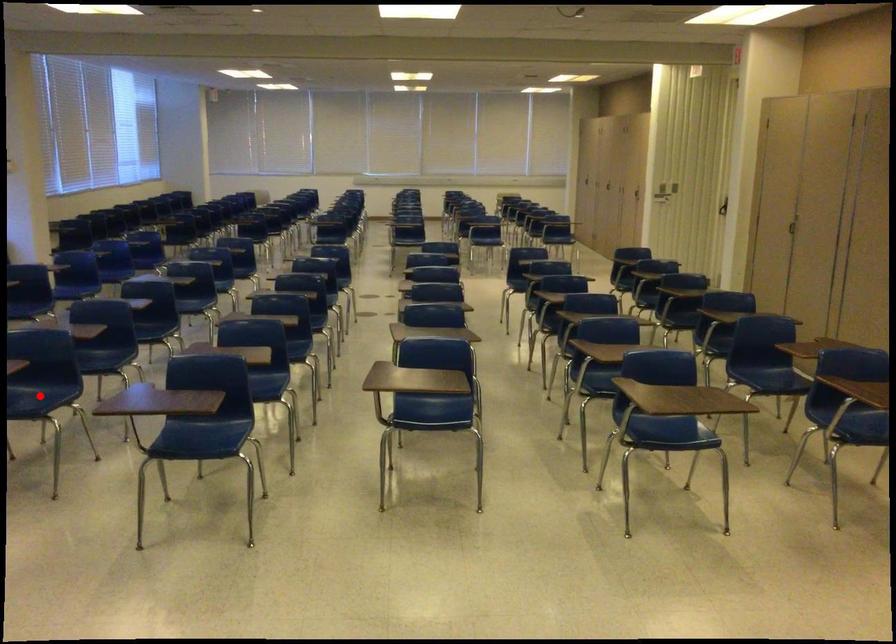
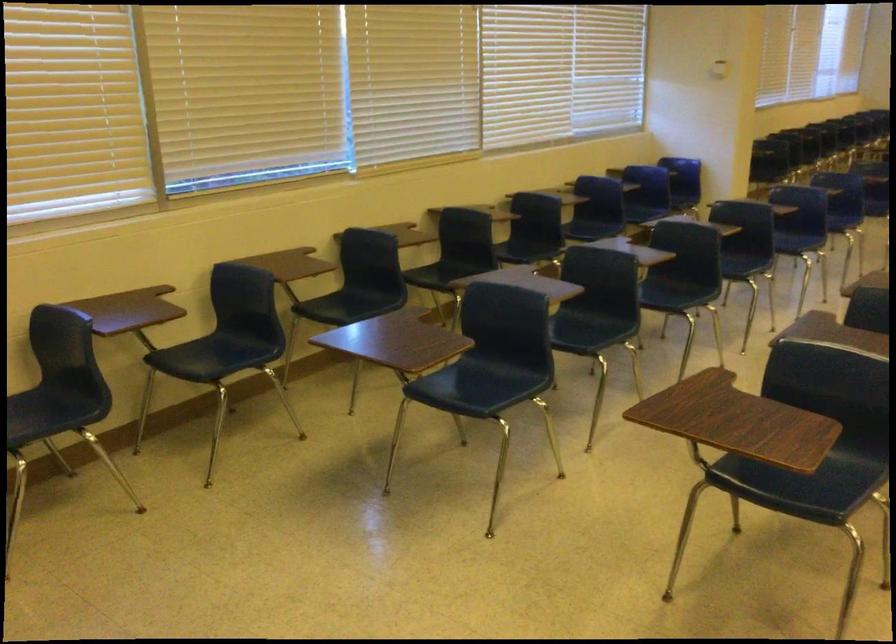
Question: I am providing you with two images of the same scene from different viewpoints. A red point is marked on the first image. Is the red point's position out of view in image 2?

Choices:
 (A) Yes
 (B) No

Answer: (A)